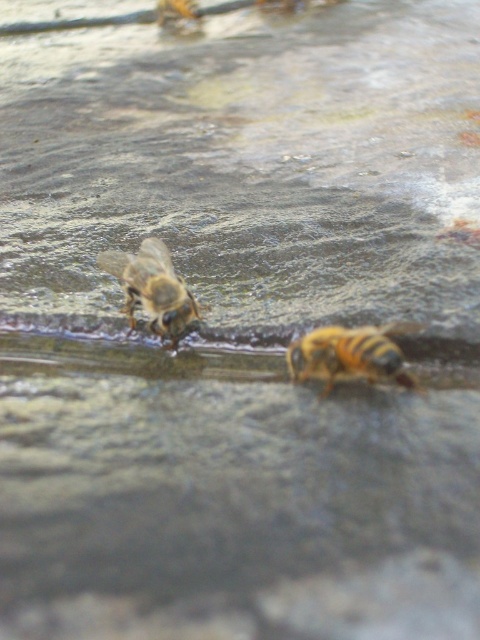
Does yellow fuzzy bee at center have a lesser width compared to yellow-brown fuzzy bee at left?

Yes.

Can you confirm if yellow fuzzy bee at center is smaller than yellow-brown fuzzy bee at left?

Correct, yellow fuzzy bee at center occupies less space than yellow-brown fuzzy bee at left.

The width and height of the screenshot is (480, 640). Describe the element at coordinates (350, 355) in the screenshot. I see `yellow fuzzy bee at center` at that location.

At what (x,y) coordinates should I click in order to perform the action: click on yellow fuzzy bee at center. Please return your answer as a coordinate pair (x, y). Looking at the image, I should click on (350, 355).